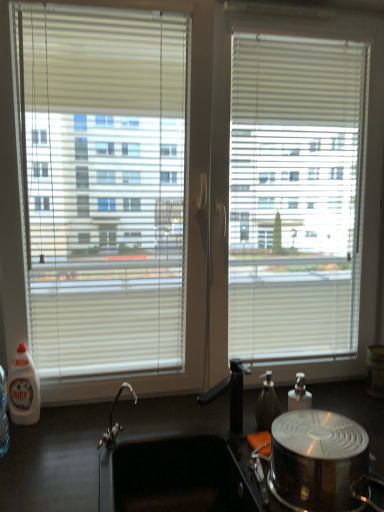
Identify the location of vacant space to the right of white plastic bottle at left, placed as the first bottle when sorted from left to right. The height and width of the screenshot is (512, 384). (73, 421).